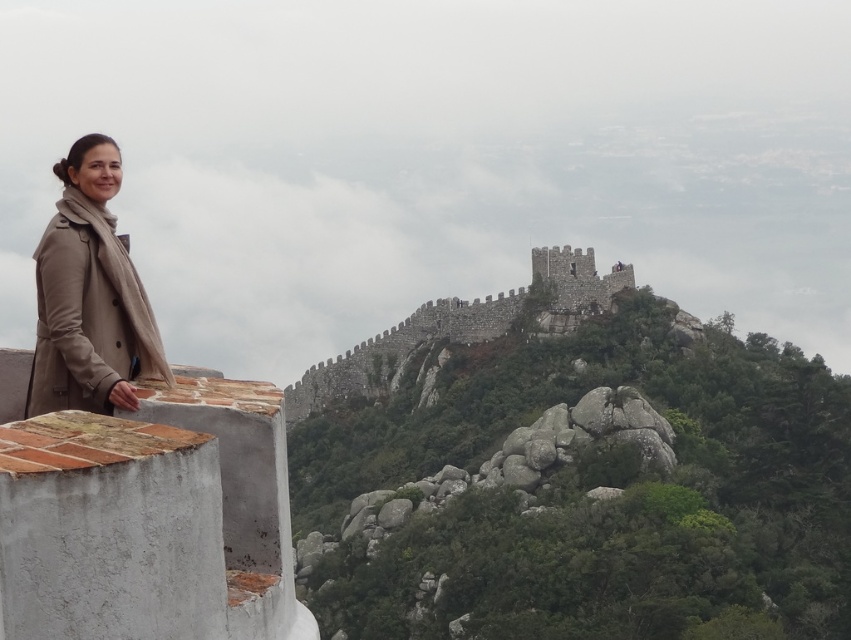
You are a photographer trying to capture a photo of the beige coat at left and the stone wall at upper center. Which object should you focus on first to ensure both are in sharp focus?

You should focus on the beige coat at left first because it is closer to the viewer than the stone wall at upper center, so adjusting focus from near to far will help both be in sharp focus.

You are a photographer trying to capture the best shot of the historic castle. You have two possible vantage points marked as point 1 at coordinates point (41, 291) and point 2 at coordinates point (301, 388). Which point is closer to the camera to ensure the castle is in focus?

Point 1 at coordinates point (41, 291) is closer to the camera than point 2 at coordinates point (301, 388), so it would be better for keeping the castle in focus.

You are a photographer planning to capture a wide shot of the historic castle. You notice the beige coat at left and the stone wall at upper center in your frame. Considering their thickness, which object would you need to ensure stays in the foreground to maintain the scene context?

The beige coat at left is thinner than the stone wall at upper center. To maintain the scene context, you should ensure the stone wall at upper center stays in the foreground as it is thicker and provides a stronger visual anchor for the historic setting.